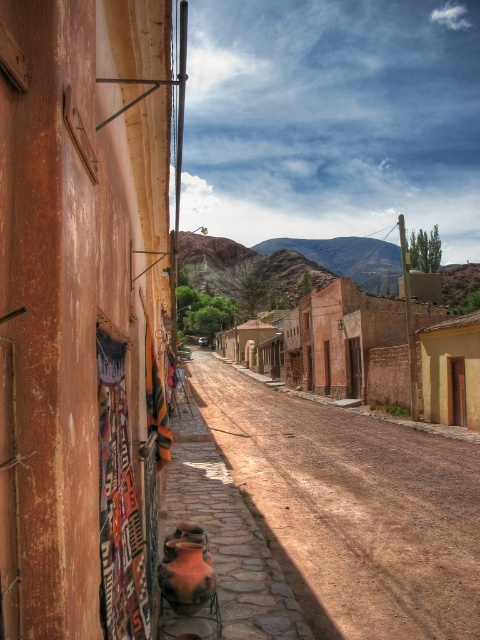
Can you confirm if brown dirt track at center is positioned below brown textured buildings at center?

Indeed, brown dirt track at center is positioned under brown textured buildings at center.

You are a GUI agent. You are given a task and a screenshot of the screen. Output one action in this format:
    pyautogui.click(x=<x>, y=<y>)
    Task: Click on the brown dirt track at center
    The width and height of the screenshot is (480, 640).
    Given the screenshot: What is the action you would take?
    [x=352, y=508]

I want to click on brown dirt track at center, so click(352, 508).